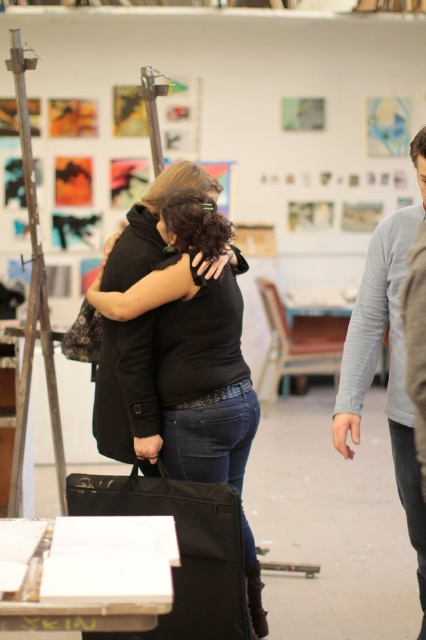
Question: Which of the following is the farthest from the observer?

Choices:
 (A) black matte coat at center
 (B) gray cotton sweater at right

Answer: (A)

Question: Does gray cotton sweater at right come in front of black matte coat at center?

Choices:
 (A) yes
 (B) no

Answer: (A)

Question: Which point is closer to the camera taking this photo?

Choices:
 (A) (365, 305)
 (B) (118, 440)

Answer: (A)

Question: Does gray cotton sweater at right appear under black matte coat at center?

Choices:
 (A) yes
 (B) no

Answer: (A)

Question: Does gray cotton sweater at right appear over black matte coat at center?

Choices:
 (A) yes
 (B) no

Answer: (B)